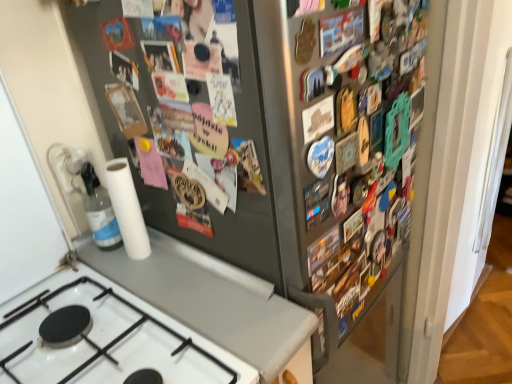
Question: Is metallic gray refrigerator at left behind transparent plastic bottle at lower left?

Choices:
 (A) yes
 (B) no

Answer: (B)

Question: Are metallic gray refrigerator at left and transparent plastic bottle at lower left beside each other?

Choices:
 (A) yes
 (B) no

Answer: (B)

Question: Is metallic gray refrigerator at left positioned with its back to transparent plastic bottle at lower left?

Choices:
 (A) yes
 (B) no

Answer: (B)

Question: Is metallic gray refrigerator at left to the right of transparent plastic bottle at lower left from the viewer's perspective?

Choices:
 (A) no
 (B) yes

Answer: (B)

Question: Is metallic gray refrigerator at left aimed at transparent plastic bottle at lower left?

Choices:
 (A) no
 (B) yes

Answer: (B)

Question: From a real-world perspective, is metallic gray refrigerator at left positioned above or below metallic button at upper center, marked as the first button in a bottom-to-top arrangement?

Choices:
 (A) above
 (B) below

Answer: (B)

Question: Considering the positions of point (197, 215) and point (318, 130), is point (197, 215) closer or farther from the camera than point (318, 130)?

Choices:
 (A) closer
 (B) farther

Answer: (B)

Question: From their relative heights in the image, would you say metallic gray refrigerator at left is taller or shorter than metallic button at upper center, which is the 3th button in top-to-bottom order?

Choices:
 (A) tall
 (B) short

Answer: (A)

Question: Visually, is metallic gray refrigerator at left positioned to the left or to the right of metallic button at upper center, which is the 3th button in top-to-bottom order?

Choices:
 (A) right
 (B) left

Answer: (B)

Question: Considering the positions of transparent plastic bottle at lower left and metallic button at upper center, which ranks as the 3th button in left-to-right order, in the image, is transparent plastic bottle at lower left taller or shorter than metallic button at upper center, which ranks as the 3th button in left-to-right order,?

Choices:
 (A) tall
 (B) short

Answer: (A)

Question: Is transparent plastic bottle at lower left bigger or smaller than metallic button at upper center, acting as the 1th button starting from the right?

Choices:
 (A) big
 (B) small

Answer: (A)

Question: Considering the positions of transparent plastic bottle at lower left and metallic button at upper center, the first button when ordered from top to bottom, in the image, is transparent plastic bottle at lower left wider or thinner than metallic button at upper center, the first button when ordered from top to bottom,?

Choices:
 (A) wide
 (B) thin

Answer: (A)

Question: Is point [82, 177] positioned closer to the camera than point [340, 23]?

Choices:
 (A) closer
 (B) farther

Answer: (B)

Question: Is transparent plastic bottle at lower left in front of or behind metallic button at upper center, which is the second button in left-to-right order, in the image?

Choices:
 (A) front
 (B) behind

Answer: (B)

Question: From a real-world perspective, relative to metallic button at upper center, marked as the first button in a bottom-to-top arrangement, is transparent plastic bottle at lower left vertically above or below?

Choices:
 (A) above
 (B) below

Answer: (B)